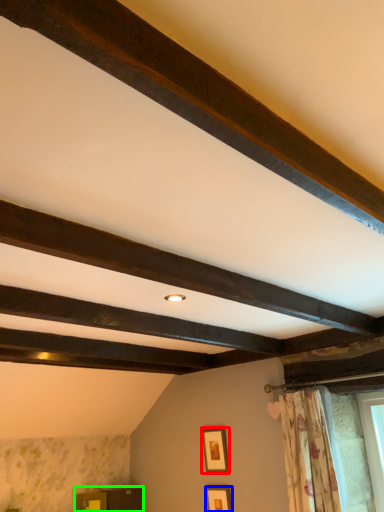
Question: Which object is the farthest from picture frame (highlighted by a red box)? Choose among these: picture frame (highlighted by a blue box) or furniture (highlighted by a green box).

Choices:
 (A) picture frame
 (B) furniture

Answer: (B)